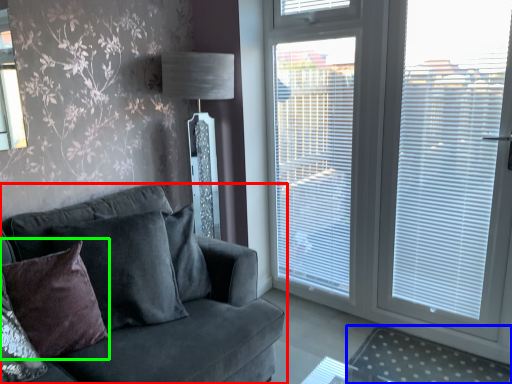
Question: Which object is positioned closest to studio couch (highlighted by a red box)? Select from plain (highlighted by a blue box) and pillow (highlighted by a green box).

Choices:
 (A) plain
 (B) pillow

Answer: (B)